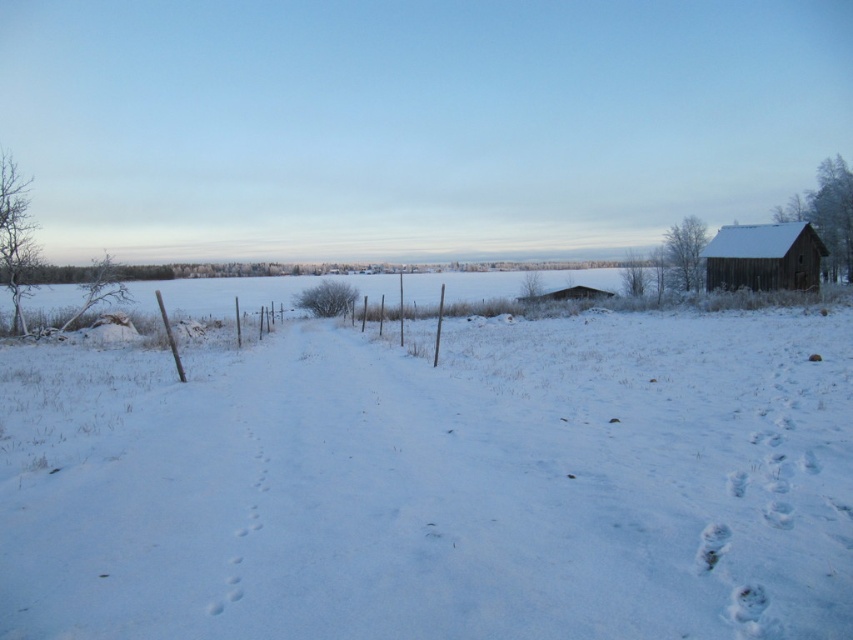
You are an animal trying to cross the wooden fence in the winter landscape. The white fluffy snow at center and the wooden barn at right are visible. Which object is closer to you as you approach the fence?

The white fluffy snow at center is closer to you as you approach the fence because it is in front of the wooden barn at right.

You are standing at the origin point of the coordinate system in this winter scene. Where is the white fluffy snow at center located in terms of its 2D coordinates?

The white fluffy snow at center is located at the 2D coordinates of point (438, 484).